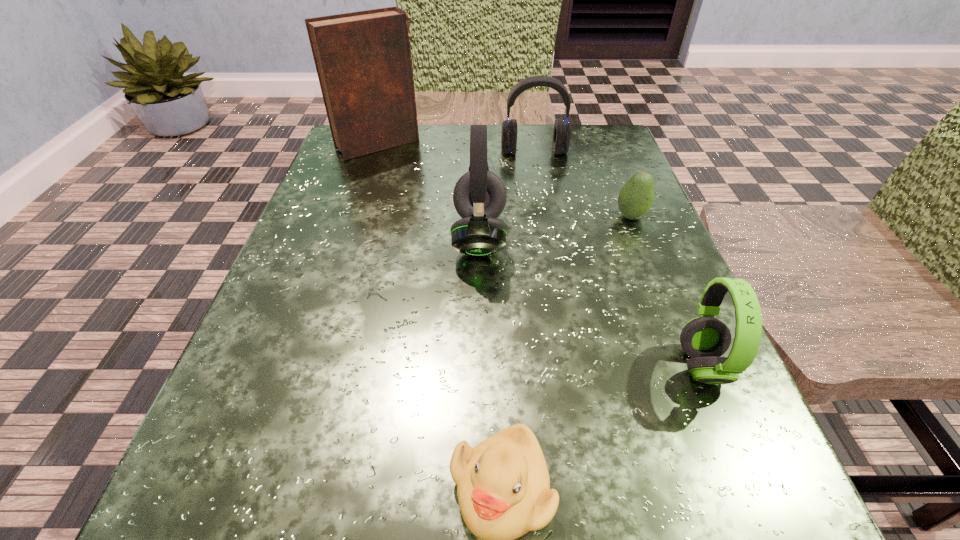
Image resolution: width=960 pixels, height=540 pixels. What are the coordinates of `vacant space at the left edge` in the screenshot? It's located at [352, 259].

At what (x,y) coordinates should I click in order to perform the action: click on free space at the right edge. Please return your answer as a coordinate pair (x, y). The height and width of the screenshot is (540, 960). Looking at the image, I should click on (666, 256).

Locate an element on the screen. vacant space at the far left corner of the desktop is located at coordinates (383, 168).

In the image, there is a desktop. In order to click on vacant space at the near left corner in this screenshot , I will do `click(322, 524)`.

At what (x,y) coordinates should I click in order to perform the action: click on unoccupied area between the tallest object and the nearest headset. Please return your answer as a coordinate pair (x, y). This screenshot has height=540, width=960. Looking at the image, I should click on (540, 255).

This screenshot has height=540, width=960. Find the location of `free spot between the leftmost object and the rightmost headset`. free spot between the leftmost object and the rightmost headset is located at coordinates (540, 255).

Identify the location of unoccupied area between the nearest headset and the farthest headset. The image size is (960, 540). (618, 258).

Identify the location of free space that is in between the second headset from right to left and the avocado. The image size is (960, 540). (583, 184).

Locate an element on the screen. This screenshot has height=540, width=960. object that can be found as the closest to the second farthest headset is located at coordinates (562, 131).

Where is `object identified as the second closest to the farthest headset`? This screenshot has width=960, height=540. object identified as the second closest to the farthest headset is located at coordinates (635, 199).